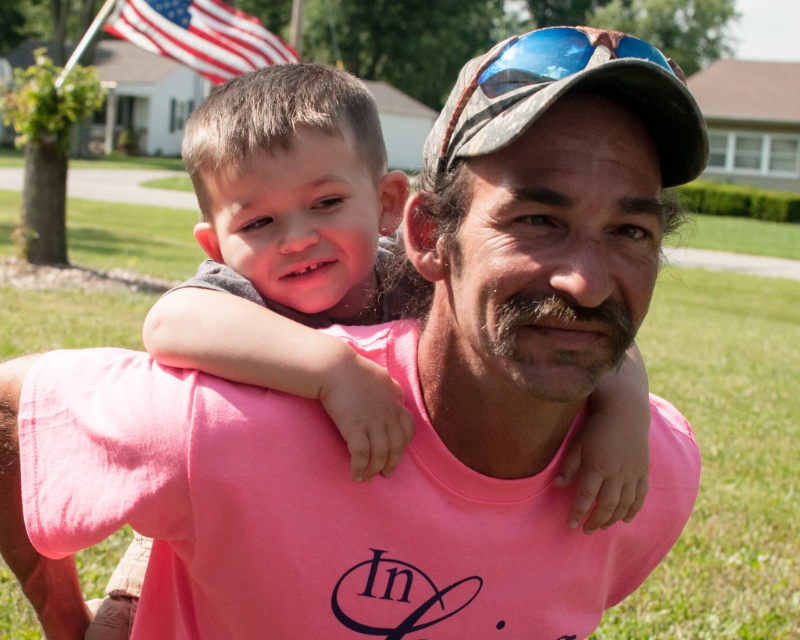
Question: Among these points, which one is nearest to the camera?

Choices:
 (A) (694, 109)
 (B) (528, 45)

Answer: (A)

Question: Can you confirm if american flag at upper left is positioned to the right of blue reflective lens at center?

Choices:
 (A) yes
 (B) no

Answer: (B)

Question: Which of the following is the closest to the observer?

Choices:
 (A) (518, 48)
 (B) (528, 92)

Answer: (B)

Question: Is camouflage fabric baseball cap at upper center smaller than american flag at upper left?

Choices:
 (A) no
 (B) yes

Answer: (B)

Question: Can you confirm if american flag at upper left is positioned to the left of blue reflective lens at center?

Choices:
 (A) no
 (B) yes

Answer: (B)

Question: Which point appears farthest from the camera in this image?

Choices:
 (A) (514, 88)
 (B) (238, 48)

Answer: (B)